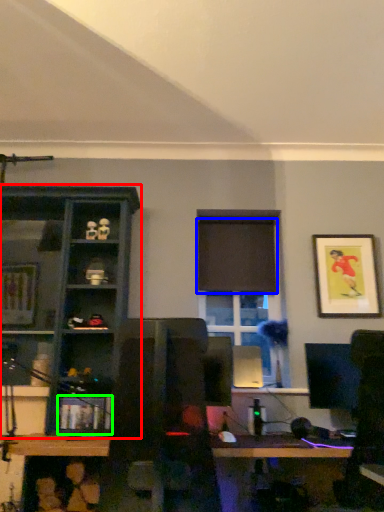
Question: Which is nearer to the shelf (highlighted by a red box)? curtain (highlighted by a blue box) or shelf (highlighted by a green box).

Choices:
 (A) curtain
 (B) shelf

Answer: (B)